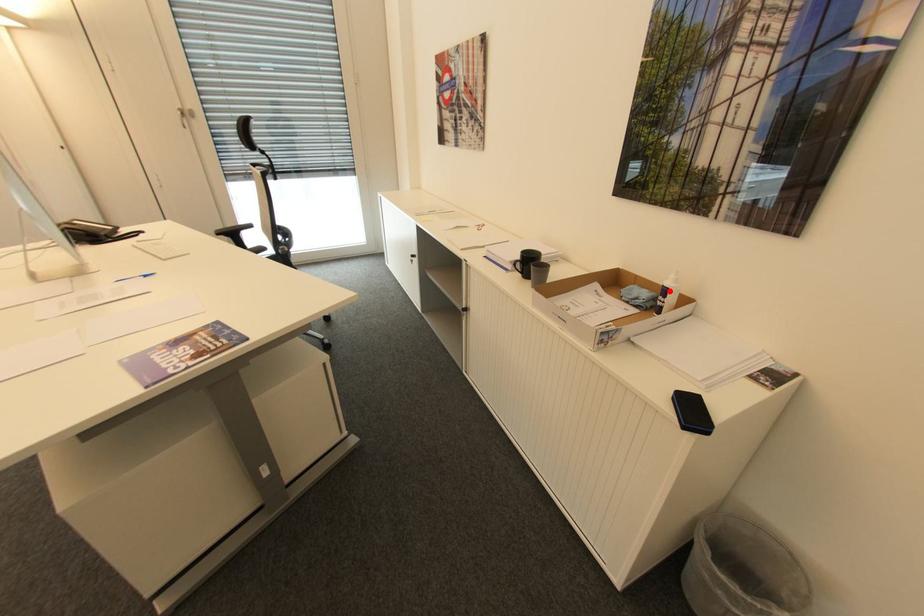
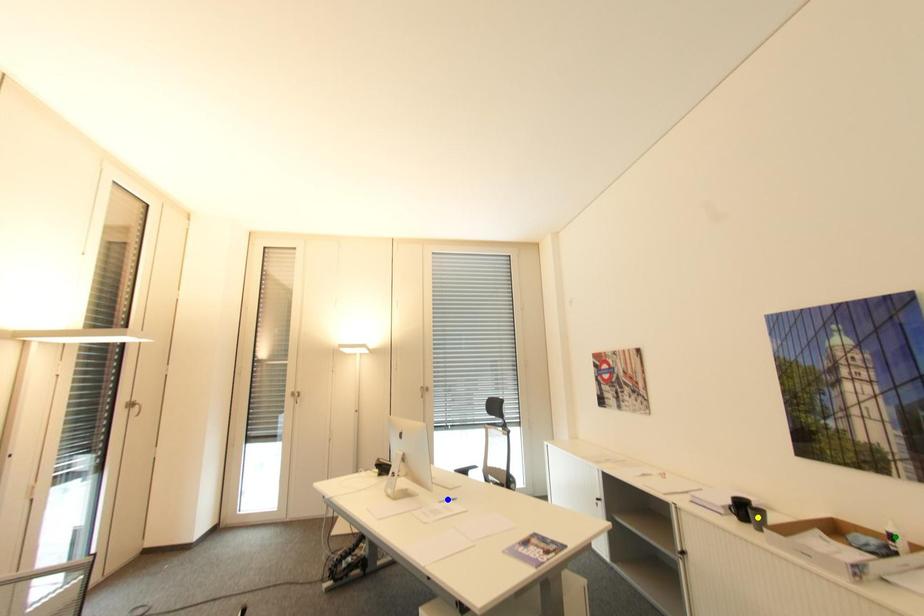
Question: I am providing you with two images of the same scene from different viewpoints. A red point is marked on the first image. You are given multiple points on the second image. Can you choose the point in image 2 that corresponds to the point in image 1?

Choices:
 (A) green point
 (B) blue point
 (C) yellow point

Answer: (A)